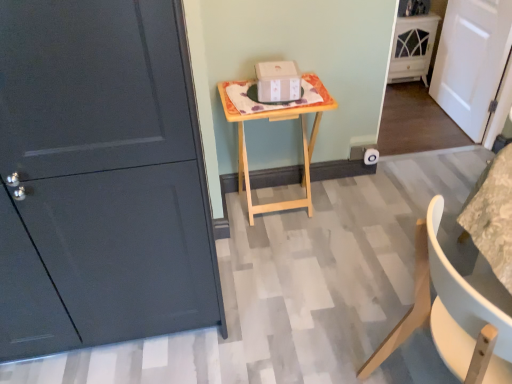
Question: Is white matte door at right, which ranks as the 1th door in back-to-front order, bigger than matte dark gray door at left, which is the 2th door from right to left?

Choices:
 (A) no
 (B) yes

Answer: (A)

Question: Is matte dark gray door at left, marked as the second door in a back-to-front arrangement, a part of white matte door at right, which is the 2th door from left to right?

Choices:
 (A) yes
 (B) no

Answer: (B)

Question: Does white matte door at right, which ranks as the 1th door in back-to-front order, lie behind matte dark gray door at left, positioned as the 1th door in left-to-right order?

Choices:
 (A) yes
 (B) no

Answer: (A)

Question: From the image's perspective, is white matte door at right, the 1th door when ordered from right to left, under matte dark gray door at left, positioned as the 1th door in left-to-right order?

Choices:
 (A) no
 (B) yes

Answer: (A)

Question: From the image's perspective, is white matte door at right, the second door when ordered from front to back, on matte dark gray door at left, which is the 2th door from right to left?

Choices:
 (A) no
 (B) yes

Answer: (B)

Question: Does white matte door at right, which ranks as the 1th door in back-to-front order, have a lesser height compared to matte dark gray door at left, marked as the second door in a back-to-front arrangement?

Choices:
 (A) no
 (B) yes

Answer: (B)

Question: Would you say white cardboard box at center contains white matte chair at lower right?

Choices:
 (A) no
 (B) yes

Answer: (A)

Question: From a real-world perspective, does white cardboard box at center sit lower than white matte chair at lower right?

Choices:
 (A) no
 (B) yes

Answer: (A)

Question: Does white cardboard box at center come in front of white matte chair at lower right?

Choices:
 (A) no
 (B) yes

Answer: (A)

Question: Can you confirm if white cardboard box at center is shorter than white matte chair at lower right?

Choices:
 (A) no
 (B) yes

Answer: (B)

Question: From a real-world perspective, is white cardboard box at center on top of white matte chair at lower right?

Choices:
 (A) yes
 (B) no

Answer: (A)

Question: Is white cardboard box at center to the right of white matte chair at lower right from the viewer's perspective?

Choices:
 (A) no
 (B) yes

Answer: (A)

Question: Are white cardboard box at center and natural wood table at center beside each other?

Choices:
 (A) no
 (B) yes

Answer: (A)